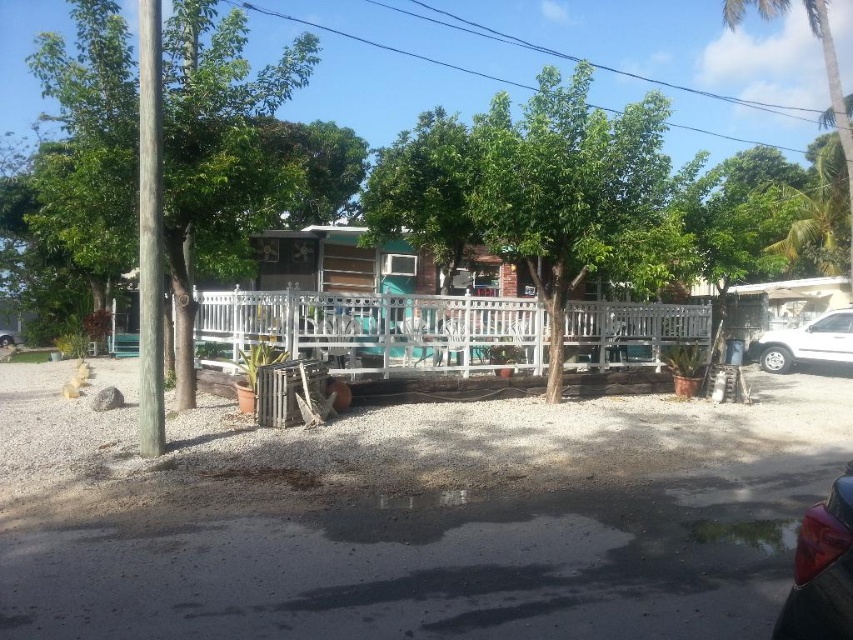
Looking at this image, you are standing in the front yard looking towards the house. You see a green leafy tree at center and a green leafy tree at left. Which tree is closer to the ground?

The green leafy tree at center is located below green leafy tree at left, so it is closer to the ground.